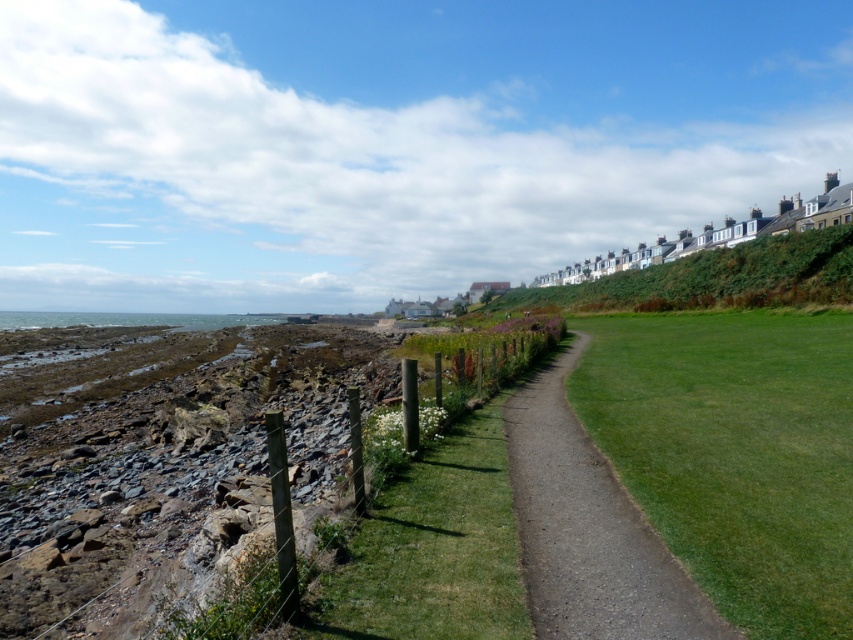
Does dirt/gravel path at center have a smaller size compared to wooden post fence at lower left?

Yes, dirt/gravel path at center is smaller than wooden post fence at lower left.

Is point (619, 602) less distant than point (480, 337)?

That is True.

Locate an element on the screen. dirt/gravel path at center is located at coordinates (589, 529).

What are the coordinates of `dirt/gravel path at center` in the screenshot? It's located at (589, 529).

Does green smooth lawn at center-right have a greater height compared to dirt/gravel path at center?

Yes, green smooth lawn at center-right is taller than dirt/gravel path at center.

Is green smooth lawn at center-right wider than dirt/gravel path at center?

Indeed, green smooth lawn at center-right has a greater width compared to dirt/gravel path at center.

Which is in front, point (576, 326) or point (619, 577)?

Point (619, 577)

Identify the location of green smooth lawn at center-right. (735, 452).

Measure the distance between point [604,349] and camera.

A distance of 23.66 meters exists between point [604,349] and camera.

Locate an element on the screen. green smooth lawn at center-right is located at coordinates (735, 452).

You are a GUI agent. You are given a task and a screenshot of the screen. Output one action in this format:
    pyautogui.click(x=<x>, y=<y>)
    Task: Click on the green smooth lawn at center-right
    
    Given the screenshot: What is the action you would take?
    pyautogui.click(x=735, y=452)